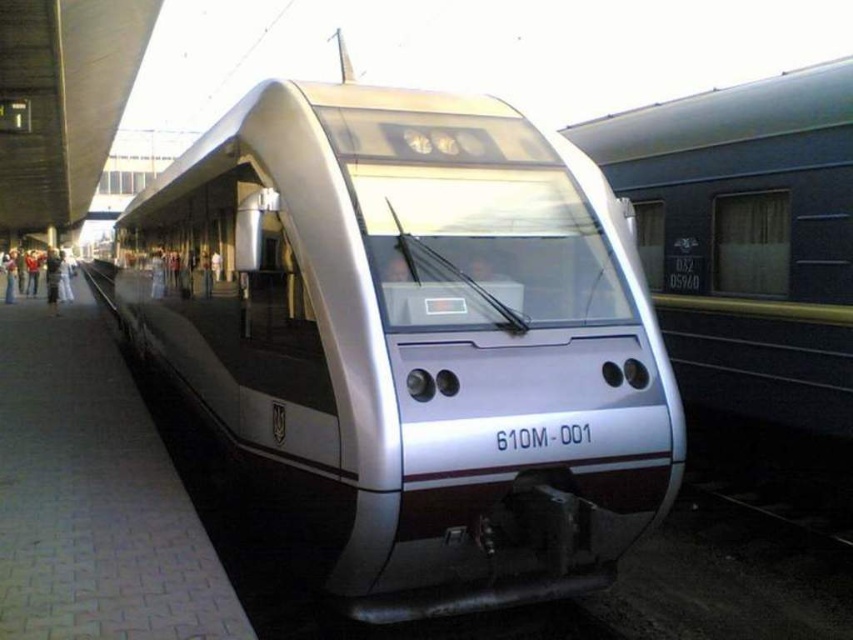
You are standing at the station platform and want to board the metallic silver train at center. Based on its position, where should you position yourself relative to the train to board it?

The metallic silver train at center is located at point (746, 237), so you should position yourself at the center of the platform to board it since the train is centrally positioned.

You are a passenger waiting at the train station platform. You see the silver metallic train at center and the metallic silver train at center. Which one is bigger?

The silver metallic train at center is larger in size compared to the metallic silver train at center.

You are a passenger waiting on the gray concrete platform at center. You want to board the silver metallic train at center. Which direction should you walk towards on the platform to reach the train?

The silver metallic train at center is positioned on the right side of gray concrete platform at center, so you should walk towards the right side of the platform to reach the train.